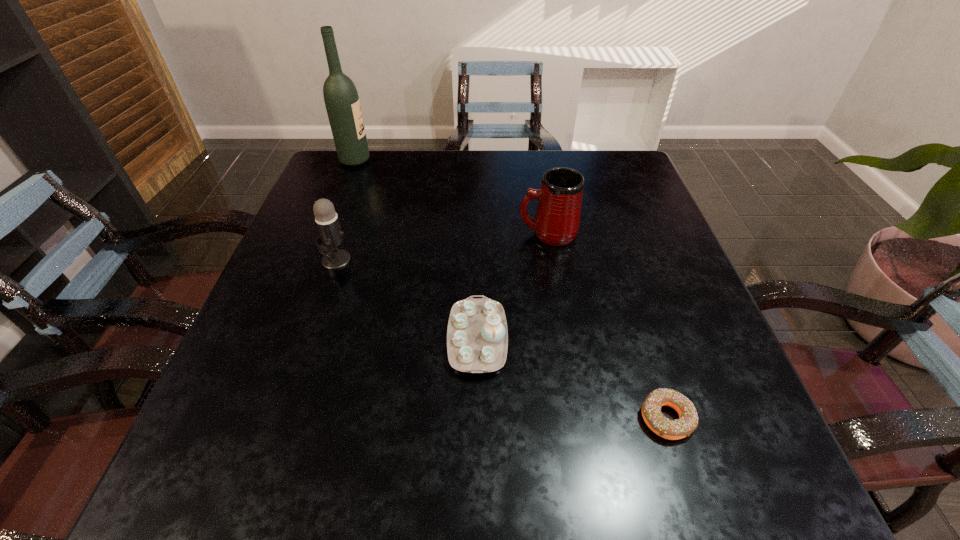
You are a GUI agent. You are given a task and a screenshot of the screen. Output one action in this format:
    pyautogui.click(x=<x>, y=<y>)
    Task: Click on the blank area located on the front of the third nearest object
    Image resolution: width=960 pixels, height=540 pixels.
    Given the screenshot: What is the action you would take?
    pyautogui.click(x=290, y=396)

The image size is (960, 540). I want to click on vacant space situated on the side of the second farthest object with the handle, so click(x=376, y=233).

Identify the location of free point located on the side of the second farthest object with the handle. This screenshot has width=960, height=540. (437, 233).

Locate an element on the screen. The image size is (960, 540). vacant region located 0.220m on the side of the second farthest object with the handle is located at coordinates (424, 233).

Find the location of a particular element. This screenshot has height=540, width=960. vacant space positioned 0.120m on the front of the chinaware is located at coordinates (477, 448).

Identify the location of free space located on the front of the nearest object. (691, 498).

The width and height of the screenshot is (960, 540). What are the coordinates of `object located at the far edge` in the screenshot? It's located at (341, 98).

The height and width of the screenshot is (540, 960). Identify the location of object that is at the near edge. (687, 422).

You are a GUI agent. You are given a task and a screenshot of the screen. Output one action in this format:
    pyautogui.click(x=<x>, y=<y>)
    Task: Click on the wine bottle present at the left edge
    Image resolution: width=960 pixels, height=540 pixels.
    Given the screenshot: What is the action you would take?
    pyautogui.click(x=341, y=98)

I want to click on microphone that is at the left edge, so click(331, 236).